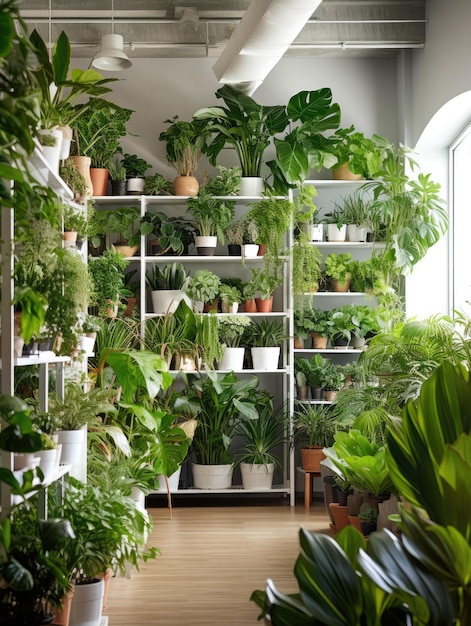
At what (x,y) coordinates should I click in order to perform the action: click on gray wall. Please return your answer as a coordinate pair (x, y). The image size is (471, 626). Looking at the image, I should click on (169, 94).